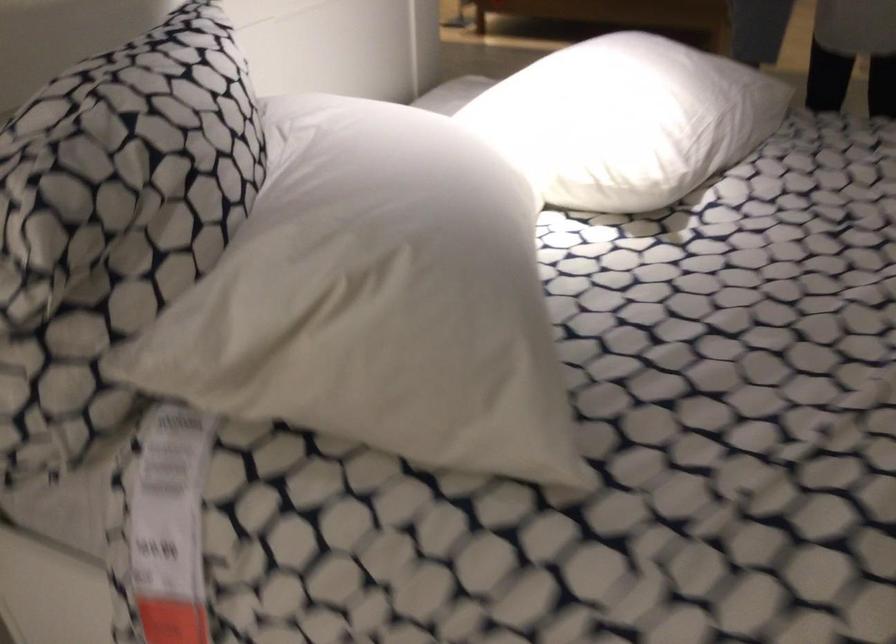
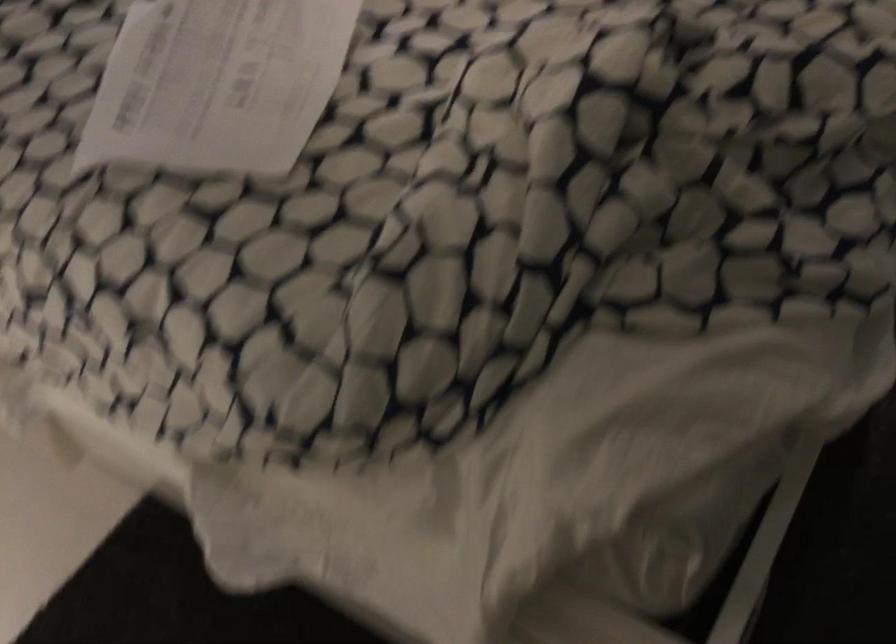
Question: Which direction would the cameraman need to move to produce the second image? Reply with the corresponding letter.

Choices:
 (A) Left
 (B) Right
 (C) Forward
 (D) Backward

Answer: (B)